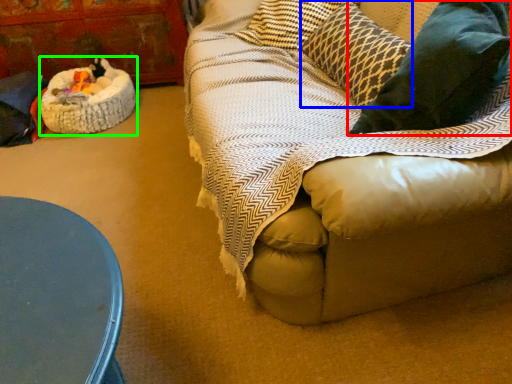
Question: Estimate the real-world distances between objects in this image. Which object is farther from throw pillow (highlighted by a red box), pillow (highlighted by a blue box) or cat bed (highlighted by a green box)?

Choices:
 (A) pillow
 (B) cat bed

Answer: (B)